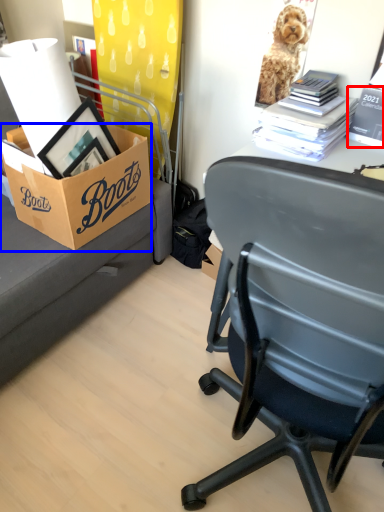
Question: Among these objects, which one is nearest to the camera, book (highlighted by a red box) or box (highlighted by a blue box)?

Choices:
 (A) book
 (B) box

Answer: (A)